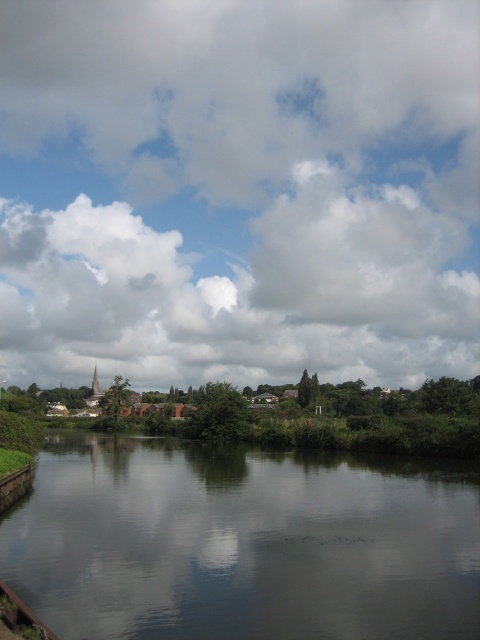
Between cloudy sky at upper center and smooth dark water at center, which one is positioned lower?

smooth dark water at center

Between point (425, 285) and point (162, 545), which one is positioned behind?

Positioned behind is point (425, 285).

Locate an element on the screen. The image size is (480, 640). cloudy sky at upper center is located at coordinates (239, 192).